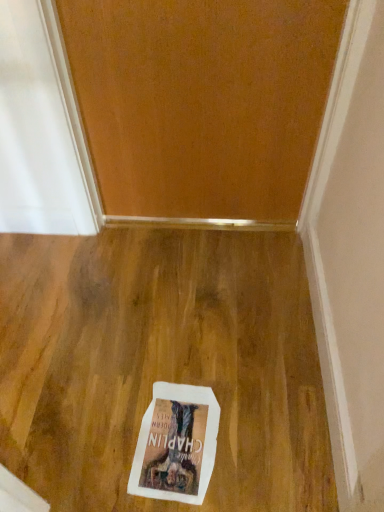
Find the location of `vacant point to the right of white paper postcard at center`. vacant point to the right of white paper postcard at center is located at coordinates (249, 433).